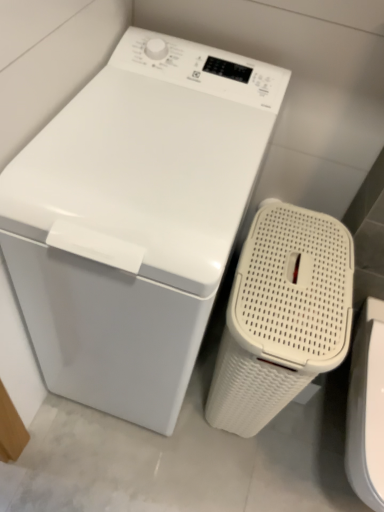
Image resolution: width=384 pixels, height=512 pixels. I want to click on free space in front of white glossy washing machine at center, so click(117, 469).